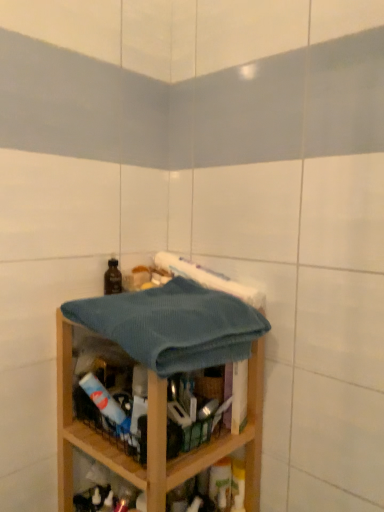
The height and width of the screenshot is (512, 384). Describe the element at coordinates (153, 436) in the screenshot. I see `wooden shelf at center` at that location.

Identify the location of teal waffle towel at center. This screenshot has height=512, width=384. (173, 325).

Is wooden shelf at center facing away from brown matte bottle at upper left?

No, wooden shelf at center is not facing the opposite direction of brown matte bottle at upper left.

Is wooden shelf at center bigger or smaller than brown matte bottle at upper left?

Considering their sizes, wooden shelf at center takes up more space than brown matte bottle at upper left.

Does wooden shelf at center appear on the right side of brown matte bottle at upper left?

Indeed, wooden shelf at center is positioned on the right side of brown matte bottle at upper left.

What are the coordinates of `shelf located underneath the brown matte bottle at upper left (from a real-world perspective)` in the screenshot? It's located at (153, 436).

Based on the photo, between wooden shelf at center and teal waffle towel at center, which one has smaller size?

Smaller between the two is teal waffle towel at center.

How different are the orientations of wooden shelf at center and teal waffle towel at center in degrees?

3.25 degrees separate the facing orientations of wooden shelf at center and teal waffle towel at center.

Visually, is wooden shelf at center positioned to the left or to the right of teal waffle towel at center?

Based on their positions, wooden shelf at center is located to the left of teal waffle towel at center.

Is wooden shelf at center not near teal waffle towel at center?

That's not correct — wooden shelf at center is a little close to teal waffle towel at center.

Would you consider teal waffle towel at center to be distant from brown matte bottle at upper left?

Actually, teal waffle towel at center and brown matte bottle at upper left are a little close together.

Which point is more forward, (194,313) or (118,272)?

The point (194,313) is more forward.

Based on the photo, is teal waffle towel at center looking in the opposite direction of brown matte bottle at upper left?

No, teal waffle towel at center's orientation is not away from brown matte bottle at upper left.

From the image's perspective, does teal waffle towel at center appear higher than brown matte bottle at upper left?

No.

Is brown matte bottle at upper left wider than wooden shelf at center?

No, brown matte bottle at upper left is not wider than wooden shelf at center.

Looking at this image, is brown matte bottle at upper left positioned with its back to wooden shelf at center?

No, brown matte bottle at upper left is not facing the opposite direction of wooden shelf at center.

Is brown matte bottle at upper left situated inside wooden shelf at center or outside?

The correct answer is: outside.

Based on their sizes in the image, would you say brown matte bottle at upper left is bigger or smaller than wooden shelf at center?

Considering their sizes, brown matte bottle at upper left takes up less space than wooden shelf at center.

From the image's perspective, which is above, brown matte bottle at upper left or teal waffle towel at center?

From the image's view, brown matte bottle at upper left is above.

The height and width of the screenshot is (512, 384). Identify the location of bottle above the teal waffle towel at center (from the image's perspective). (112, 278).

Considering the positions of objects teal waffle towel at center and wooden shelf at center in the image provided, who is more to the right, teal waffle towel at center or wooden shelf at center?

Positioned to the right is teal waffle towel at center.

Is teal waffle towel at center turned away from wooden shelf at center?

Correct, teal waffle towel at center is looking away from wooden shelf at center.

From a real-world perspective, is teal waffle towel at center physically located above or below wooden shelf at center?

From a real-world perspective, teal waffle towel at center is physically above wooden shelf at center.

The image size is (384, 512). Identify the location of shelf that appears below the brown matte bottle at upper left (from the image's perspective). (153, 436).

Find the location of a particular element. This screenshot has width=384, height=512. bath towel in front of the wooden shelf at center is located at coordinates (173, 325).

Based on their spatial positions, is wooden shelf at center or teal waffle towel at center further from brown matte bottle at upper left?

The object further to brown matte bottle at upper left is wooden shelf at center.

Looking at the image, which one is located closer to wooden shelf at center, teal waffle towel at center or brown matte bottle at upper left?

teal waffle towel at center is positioned closer to the anchor wooden shelf at center.

Looking at the image, which one is located further to wooden shelf at center, brown matte bottle at upper left or teal waffle towel at center?

brown matte bottle at upper left is positioned further to the anchor wooden shelf at center.

Considering their positions, is brown matte bottle at upper left positioned further to teal waffle towel at center than wooden shelf at center?

The object further to teal waffle towel at center is brown matte bottle at upper left.

When comparing their distances from brown matte bottle at upper left, does teal waffle towel at center or wooden shelf at center seem further?

wooden shelf at center is further to brown matte bottle at upper left.

Looking at the image, which one is located further to teal waffle towel at center, wooden shelf at center or brown matte bottle at upper left?

The object further to teal waffle towel at center is brown matte bottle at upper left.

What are the coordinates of `shelf located between teal waffle towel at center and brown matte bottle at upper left in the depth direction` in the screenshot? It's located at (153, 436).